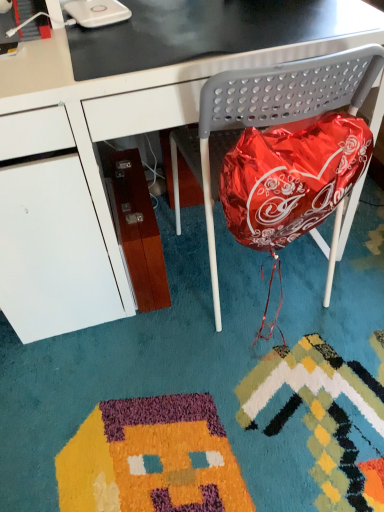
You are a GUI agent. You are given a task and a screenshot of the screen. Output one action in this format:
    pyautogui.click(x=<x>, y=<y>)
    Task: Click on the vacant space in front of metallic gray folding chair at center
    The width and height of the screenshot is (384, 512).
    Given the screenshot: What is the action you would take?
    (x=269, y=379)